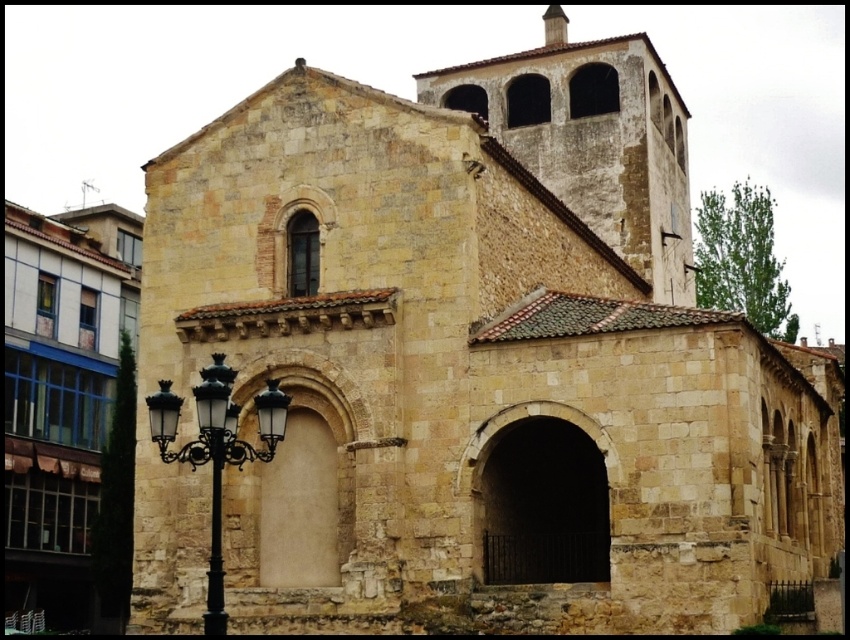
Who is higher up, beige stone church at left or black wrought iron streetlight at lower left?

Positioned higher is beige stone church at left.

Does beige stone church at left have a larger size compared to black wrought iron streetlight at lower left?

Indeed, beige stone church at left has a larger size compared to black wrought iron streetlight at lower left.

Between point (83, 509) and point (219, 497), which one is positioned in front?

Point (219, 497)

The width and height of the screenshot is (850, 640). Identify the location of beige stone church at left. (61, 396).